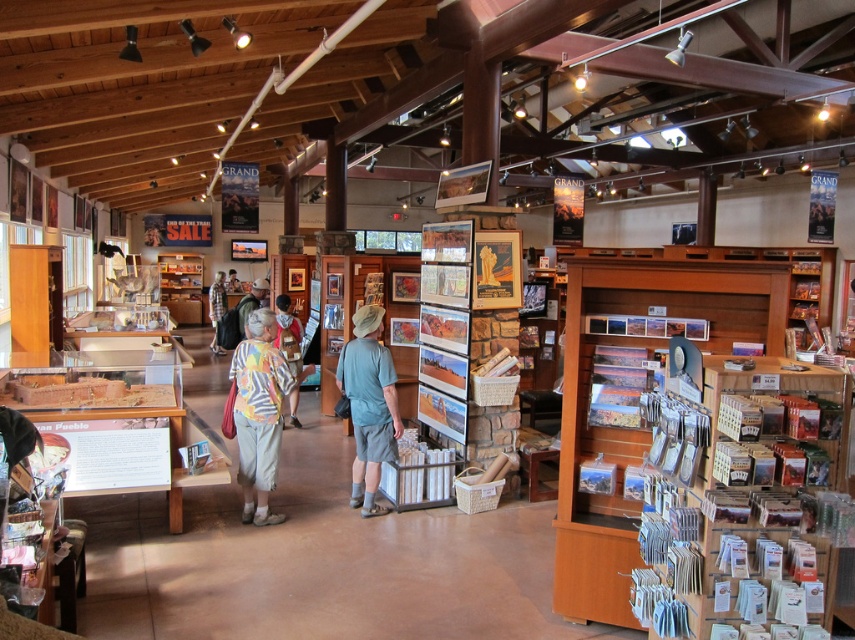
Between printed fabric shirt at center and camouflage jacket at center, which one appears on the left side from the viewer's perspective?

camouflage jacket at center

Is printed fabric shirt at center above camouflage jacket at center?

No.

Is point (267, 435) less distant than point (242, 323)?

That is True.

You are a GUI agent. You are given a task and a screenshot of the screen. Output one action in this format:
    pyautogui.click(x=<x>, y=<y>)
    Task: Click on the printed fabric shirt at center
    Image resolution: width=855 pixels, height=640 pixels.
    Given the screenshot: What is the action you would take?
    [258, 413]

Describe the element at coordinates (258, 413) in the screenshot. I see `printed fabric shirt at center` at that location.

Which of these two, printed fabric shirt at center or light blue fabric shirt at center, stands shorter?

With less height is printed fabric shirt at center.

Identify the location of printed fabric shirt at center. (258, 413).

Does light blue fabric shirt at center have a greater width compared to camouflage jacket at center?

Yes, light blue fabric shirt at center is wider than camouflage jacket at center.

Can you confirm if light blue fabric shirt at center is smaller than camouflage jacket at center?

Incorrect, light blue fabric shirt at center is not smaller in size than camouflage jacket at center.

Who is more forward, (363, 360) or (248, 314)?

Point (363, 360) is in front.

What are the coordinates of `light blue fabric shirt at center` in the screenshot? It's located at (369, 404).